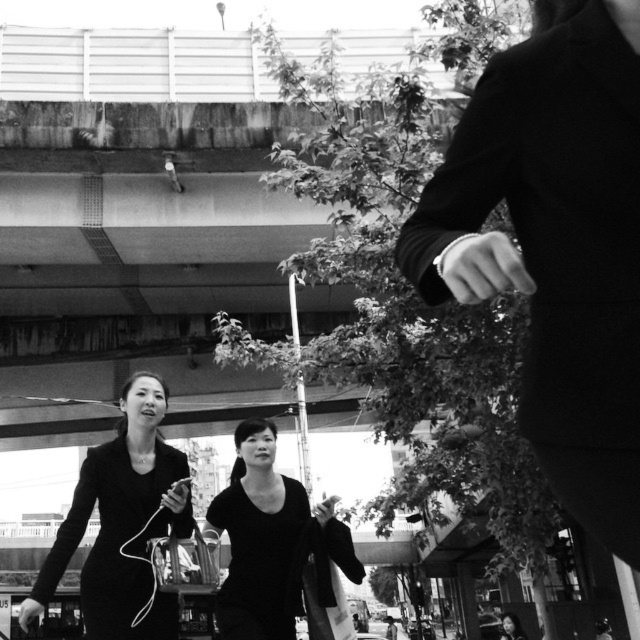
Question: Among these objects, which one is nearest to the camera?

Choices:
 (A) black matte dress at center
 (B) smooth black dress at lower center

Answer: (A)

Question: Is black matte dress at center thinner than smooth black dress at lower center?

Choices:
 (A) no
 (B) yes

Answer: (A)

Question: Which is nearer to the black matte dress at center?

Choices:
 (A) smooth black dress at lower center
 (B) matte black dress at center

Answer: (B)

Question: Does matte black dress at center have a lesser width compared to black matte dress at center?

Choices:
 (A) yes
 (B) no

Answer: (A)

Question: Which of the following is the farthest from the observer?

Choices:
 (A) black matte dress at center
 (B) matte black dress at center
 (C) smooth black dress at lower center

Answer: (C)

Question: Does matte black dress at center appear on the right side of black matte dress at center?

Choices:
 (A) yes
 (B) no

Answer: (B)